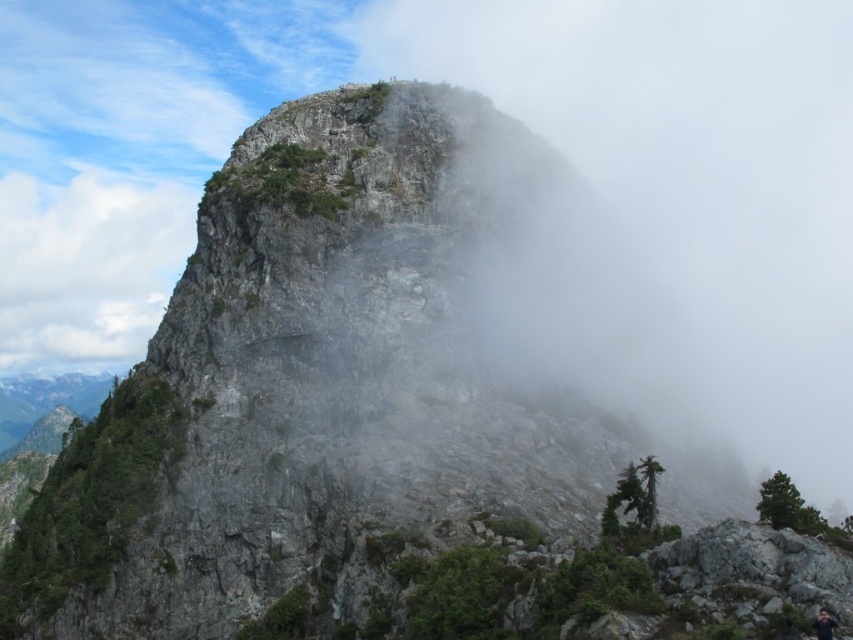
In the scene shown: You are a hiker planning to traverse the rugged mountain peak shown in the image. You have two points marked on your map, point (x=766, y=189) and point (x=824, y=625). Which point is closer to you when you are standing at the base of the mountain?

Point (x=766, y=189) is closer to you because it is further to the viewer than point (x=824, y=625), meaning it appears nearer in the image.

You are a hiker standing at the base of the mountain. You notice a white misty cloud in the scene. Where exactly is the white misty cloud at upper center located in terms of coordinates?

The white misty cloud at upper center is located at coordinates point (682,198).

You are a hiker planning to reach the summit of the mountain. You see the white misty cloud at upper center and the dark gray fabric hiker at lower right. Which object is larger in size?

The white misty cloud at upper center is bigger than the dark gray fabric hiker at lower right according to the description.